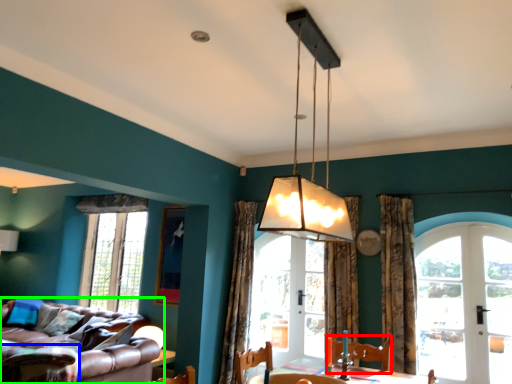
Question: Which object is positioned closest to swivel chair (highlighted by a red box)? Select from swivel chair (highlighted by a blue box) and studio couch (highlighted by a green box).

Choices:
 (A) swivel chair
 (B) studio couch

Answer: (B)